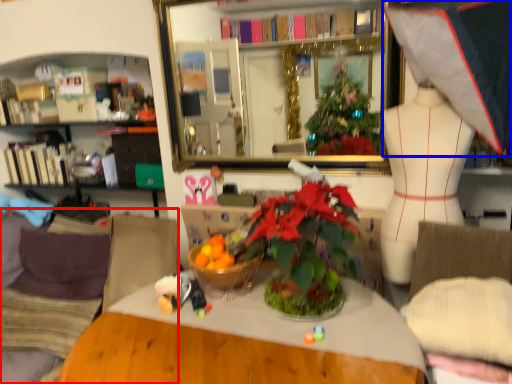
Question: Among these objects, which one is nearest to the camera, couch (highlighted by a red box) or clothing (highlighted by a blue box)?

Choices:
 (A) couch
 (B) clothing

Answer: (B)